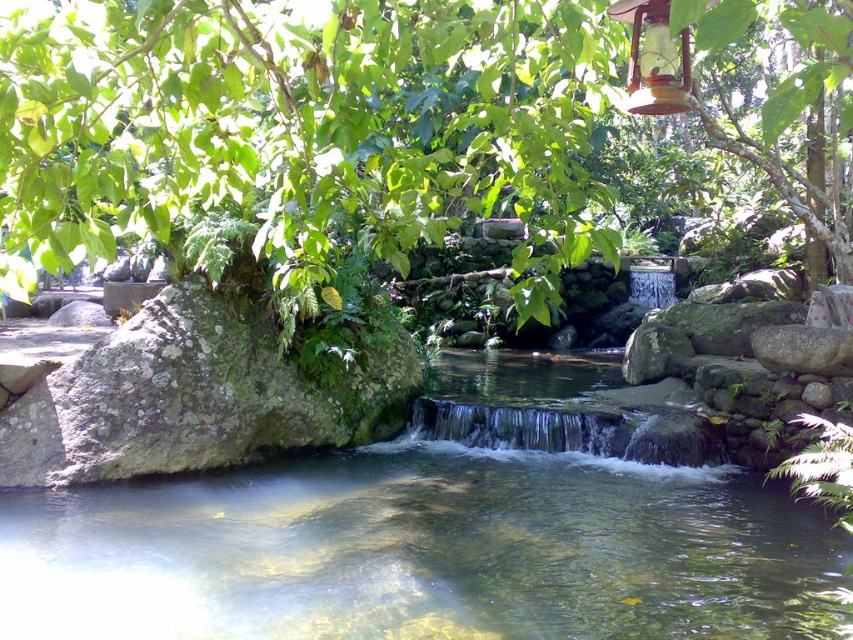
Question: Which point appears closest to the camera in this image?

Choices:
 (A) (106, 257)
 (B) (84, 598)

Answer: (A)

Question: In this image, where is green leafy tree at upper center located relative to clear water stream at center?

Choices:
 (A) above
 (B) below

Answer: (A)

Question: Which point is closer to the camera?

Choices:
 (A) clear water stream at center
 (B) green leafy tree at upper center

Answer: (B)

Question: Does green leafy tree at upper center have a smaller size compared to clear water stream at center?

Choices:
 (A) yes
 (B) no

Answer: (B)

Question: In this image, where is green leafy tree at upper center located relative to clear water stream at center?

Choices:
 (A) right
 (B) left

Answer: (A)